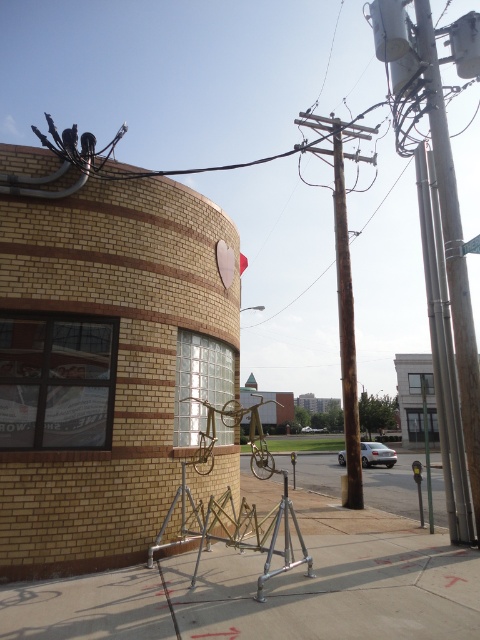
You are a delivery person trying to park your 1.5 meter wide delivery cart between the rusty wood telegraph pole at center and the concrete sidewalk at lower center. Can you fit your cart in that space?

→ The rusty wood telegraph pole at center and concrete sidewalk at lower center are 7.49 meters apart from each other. Since the distance between them is 7.49 meters, which is significantly wider than your 1.5 meter wide delivery cart, you can easily fit your cart in that space.

You are standing on the concrete sidewalk at center and want to walk towards the building in the background. Which direction should you walk to avoid the rusty wood telegraph pole at center?

The concrete sidewalk at center is in front of the rusty wood telegraph pole at center, so to walk towards the building while avoiding the pole, you should move sideways along the sidewalk away from the pole.

You are a delivery person trying to park your electric scooter. You see the concrete sidewalk at center and the rusty wood telegraph pole at center. Which surface can you safely park your scooter on?

The concrete sidewalk at center has a smaller size compared to the rusty wood telegraph pole at center, so the scooter should be parked on the concrete sidewalk at center as it provides a stable and flat surface for parking.